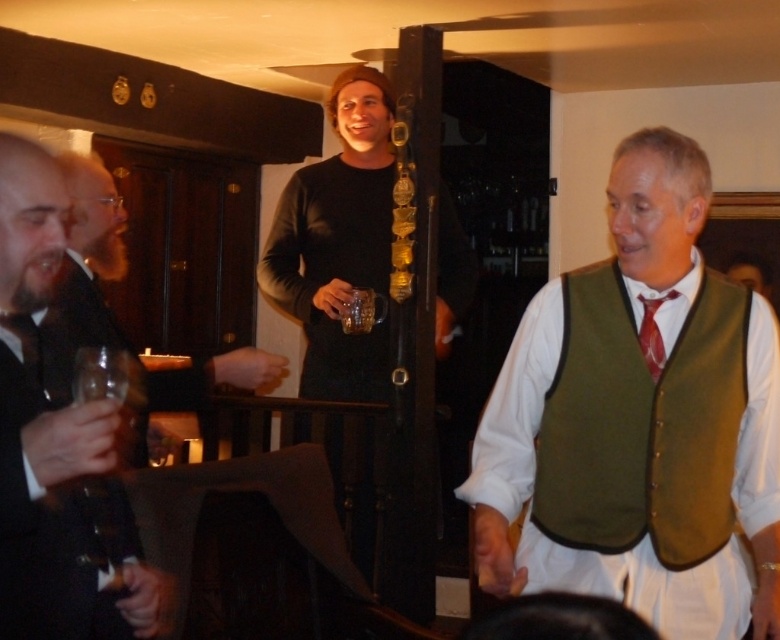
You are a photographer at the event and want to capture a photo of the matte black shirt at upper center and the translucent glass at center. Based on their positions, which object should you focus on first if you want to include both in the frame without moving the camera?

The matte black shirt at upper center is to the left of the translucent glass at center, so you should focus on the matte black shirt at upper center first as it is positioned to the left and closer to the left edge of the frame.

You are a photographer at the event and want to capture a clear photo of both the green fabric vest at center and the matte black shirt at upper center. Which object should you adjust your camera focus to first to ensure both are in frame?

The matte black shirt at upper center is behind the green fabric vest at center, so you should focus on the green fabric vest at center first to ensure both are in frame.